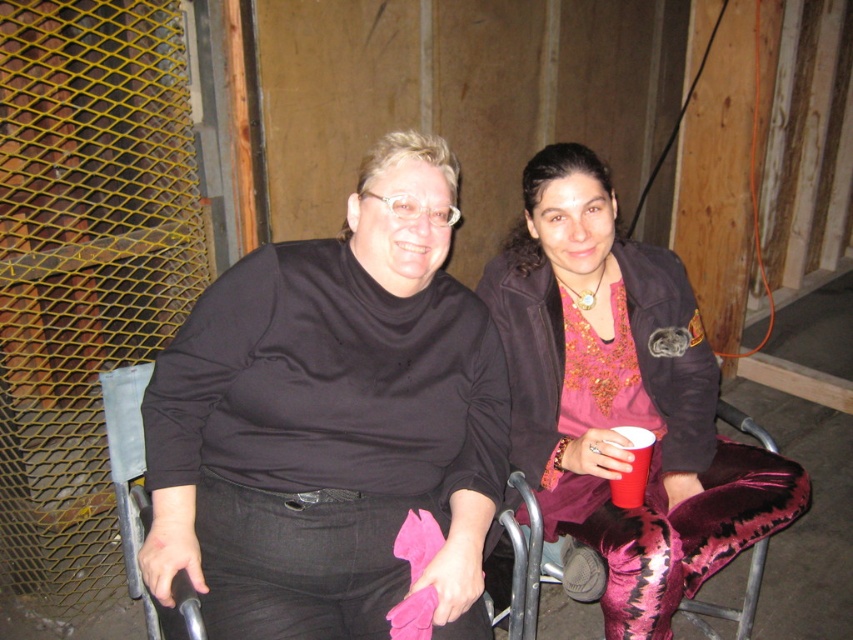
You are a photographer setting up a shoot in this space. You need to place a small stool between the velvet leggings at center and the velvet purple chair at center. Which object should the stool be closer to to ensure it doesn

The velvet leggings at center is taller than the velvet purple chair at center. Therefore, the stool should be placed closer to the velvet purple chair at center to maintain balance between the two objects.

You are a photographer setting up a shoot in the described scene. You need to place a small table between the velvet pink pants at center and the velvet purple chair at center. Based on their heights, which object should the table be placed closer to for stability?

The velvet pink pants at center is much taller than the velvet purple chair at center, so the table should be placed closer to the velvet purple chair at center to ensure stability.

You are a photographer setting up a shoot in this indoor area. You need to position a small light between the velvet pink pants at center and the velvet purple chair at center. Based on their current positions, where should you place the light to ensure it is between them?

The velvet pink pants at center is to the left of the velvet purple chair at center, so you should place the light between them by positioning it to the right of the velvet pink pants at center and to the left of the velvet purple chair at center.